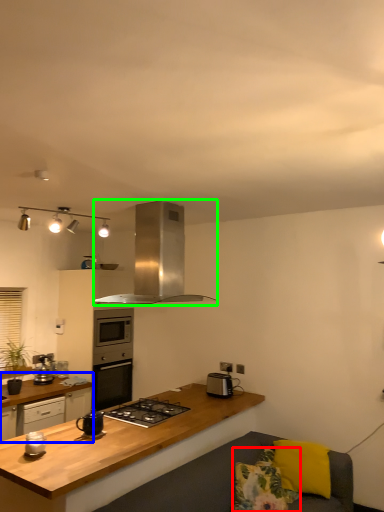
Question: Considering the real-world distances, which object is closest to pillow (highlighted by a red box)? cabinetry (highlighted by a blue box) or kitchen appliance (highlighted by a green box).

Choices:
 (A) cabinetry
 (B) kitchen appliance

Answer: (B)